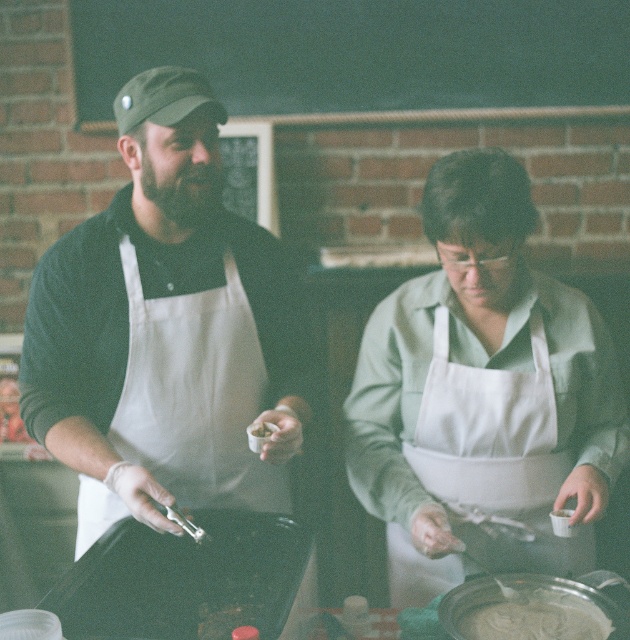
Does point (152, 298) come farther from viewer compared to point (593, 616)?

Yes.

Between point (67, 388) and point (481, 593), which one is positioned behind?

The point (67, 388) is more distant.

The width and height of the screenshot is (630, 640). I want to click on matte white apron at left, so click(164, 330).

Which is above, white matte apron at center or white fabric apron at center?

Positioned higher is white matte apron at center.

Can you confirm if white matte apron at center is positioned below white fabric apron at center?

No, white matte apron at center is not below white fabric apron at center.

This screenshot has width=630, height=640. Find the location of `white matte apron at center`. white matte apron at center is located at coordinates (483, 392).

Does matte white apron at left have a greater height compared to white matte apron at center?

Correct, matte white apron at left is much taller as white matte apron at center.

Who is more forward, (265,260) or (421,448)?

Positioned in front is point (421,448).

Who is more distant from viewer, (163, 248) or (418, 276)?

The point (418, 276) is behind.

In order to click on matte white apron at left in this screenshot , I will do `click(164, 330)`.